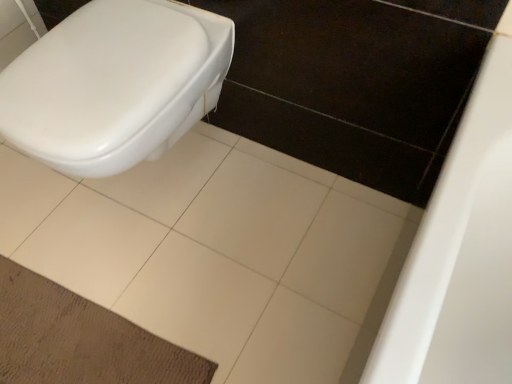
Question: Does brown textured mat at lower left come behind white glossy toilet at left?

Choices:
 (A) no
 (B) yes

Answer: (B)

Question: Considering the relative positions of brown textured mat at lower left and white glossy toilet at left in the image provided, is brown textured mat at lower left to the right of white glossy toilet at left from the viewer's perspective?

Choices:
 (A) yes
 (B) no

Answer: (B)

Question: Can you confirm if brown textured mat at lower left is bigger than white glossy toilet at left?

Choices:
 (A) no
 (B) yes

Answer: (A)

Question: Is brown textured mat at lower left to the left of white glossy toilet at left from the viewer's perspective?

Choices:
 (A) no
 (B) yes

Answer: (B)

Question: From a real-world perspective, is brown textured mat at lower left over white glossy toilet at left?

Choices:
 (A) yes
 (B) no

Answer: (B)

Question: From the image's perspective, does brown textured mat at lower left appear lower than white glossy toilet at left?

Choices:
 (A) no
 (B) yes

Answer: (B)

Question: Does white ceramic tile at center have a lesser width compared to brown textured mat at lower left?

Choices:
 (A) yes
 (B) no

Answer: (B)

Question: From a real-world perspective, does white ceramic tile at center sit lower than brown textured mat at lower left?

Choices:
 (A) no
 (B) yes

Answer: (B)

Question: Does white ceramic tile at center have a lesser height compared to brown textured mat at lower left?

Choices:
 (A) yes
 (B) no

Answer: (A)

Question: Is white ceramic tile at center taller than brown textured mat at lower left?

Choices:
 (A) yes
 (B) no

Answer: (B)

Question: Does white ceramic tile at center contain brown textured mat at lower left?

Choices:
 (A) no
 (B) yes

Answer: (B)

Question: Could you tell me if white ceramic tile at center is facing brown textured mat at lower left?

Choices:
 (A) no
 (B) yes

Answer: (A)

Question: From the image's perspective, is brown textured mat at lower left located beneath white ceramic tile at center?

Choices:
 (A) yes
 (B) no

Answer: (A)